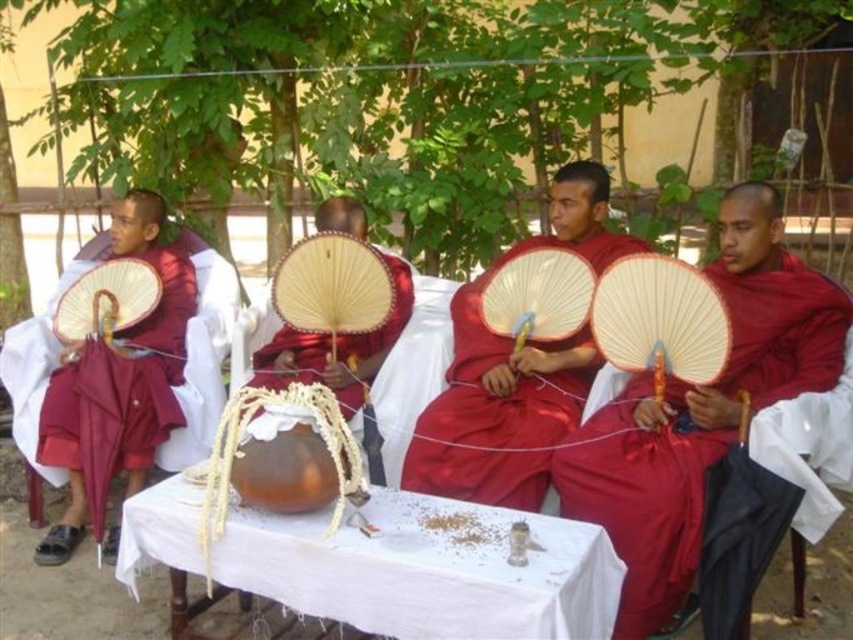
You are standing at the point labeled point (62, 458) and want to walk to the point labeled point (660, 481). Which direction should you move?

You should move forward because point (660, 481) is in front of point (62, 458).

You are an observer standing in front of the scene. You notice the matte red robe at right and the matte red fan at center. Which object is taller when comparing their heights?

The matte red fan at center is taller than the matte red robe at right.

In the scene shown: You are standing in front of the group of people in traditional red robes. Where exactly is the matte red robe at right located in relation to the other robes?

The matte red robe at right is located at point (645, 506).